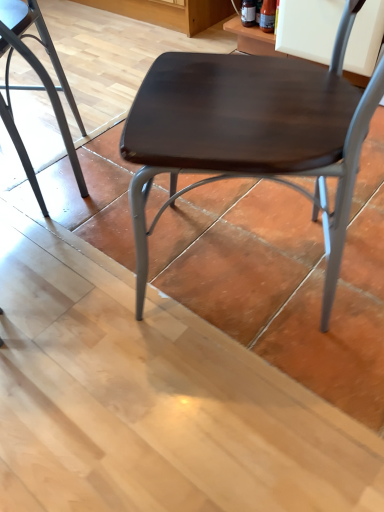
Identify the location of free space to the back side of metallic gray chair at lower left, which appears as the 1th chair when viewed from the left. The height and width of the screenshot is (512, 384). (79, 101).